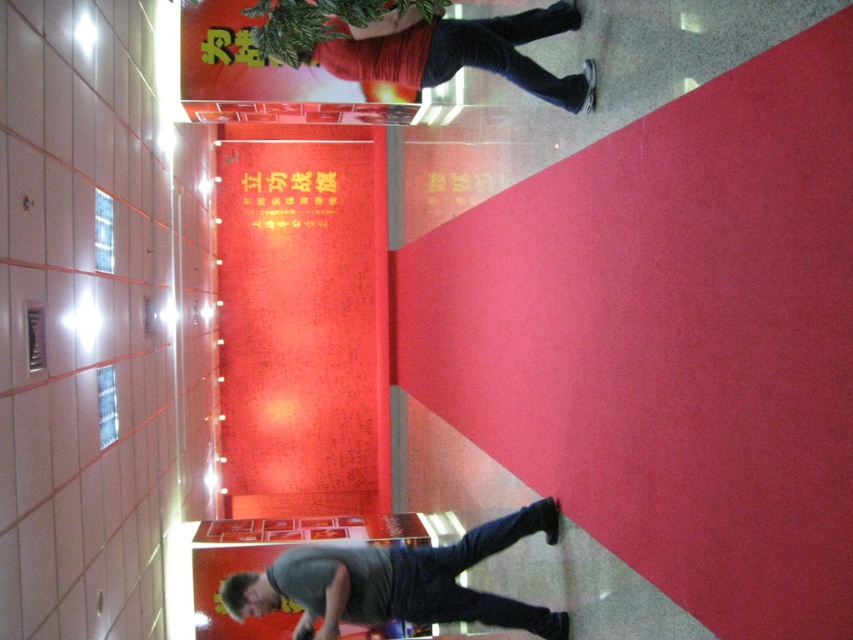
Does matte black pants at upper right have a larger size compared to red paper sign at upper center?

Yes, matte black pants at upper right is bigger than red paper sign at upper center.

Does matte black pants at upper right appear on the right side of red paper sign at upper center?

Correct, you'll find matte black pants at upper right to the right of red paper sign at upper center.

This screenshot has width=853, height=640. I want to click on matte black pants at upper right, so click(457, 52).

Which of these two, gray matte shirt at lower center or red paper sign at upper center, stands taller?

gray matte shirt at lower center is taller.

Can you confirm if gray matte shirt at lower center is smaller than red paper sign at upper center?

No.

Find the location of a particular element. This screenshot has width=853, height=640. gray matte shirt at lower center is located at coordinates (397, 582).

Does gray matte shirt at lower center appear under matte black pants at upper right?

Correct, gray matte shirt at lower center is located below matte black pants at upper right.

Who is taller, gray matte shirt at lower center or matte black pants at upper right?

With more height is gray matte shirt at lower center.

Which is in front, point (485, 620) or point (280, 19)?

Point (280, 19)

At what (x,y) coordinates should I click in order to perform the action: click on gray matte shirt at lower center. Please return your answer as a coordinate pair (x, y). Looking at the image, I should click on (397, 582).